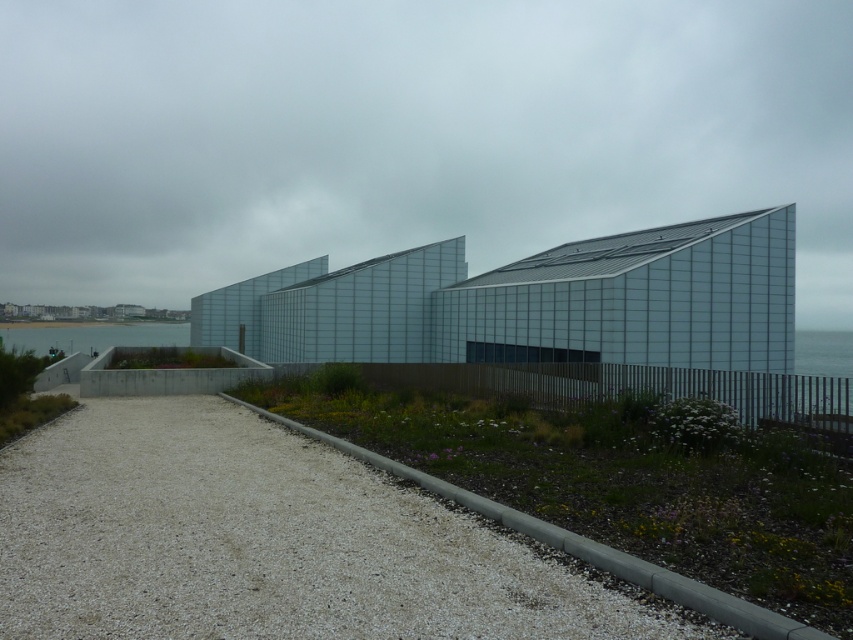
Can you confirm if white gravel at lower left is positioned to the left of clear water at lower left?

In fact, white gravel at lower left is to the right of clear water at lower left.

Is white gravel at lower left taller than clear water at lower left?

In fact, white gravel at lower left may be shorter than clear water at lower left.

Who is more distant from viewer, (465, 548) or (32, 339)?

The point (32, 339) is more distant.

Find the location of a particular element. Image resolution: width=853 pixels, height=640 pixels. white gravel at lower left is located at coordinates (268, 541).